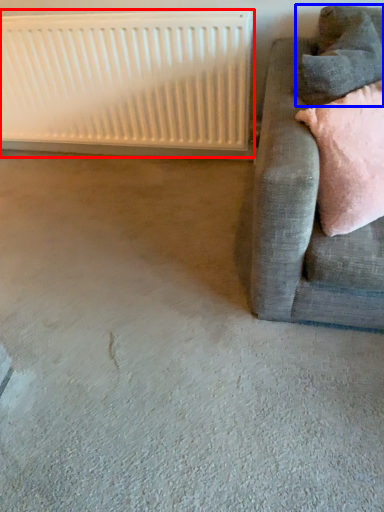
Question: Which of the following is the farthest to the observer, radiator (highlighted by a red box) or pillow (highlighted by a blue box)?

Choices:
 (A) radiator
 (B) pillow

Answer: (A)